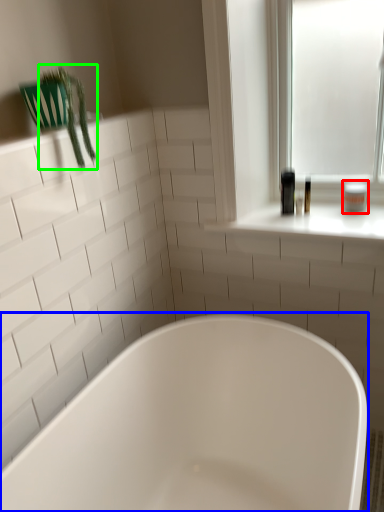
Question: Which object is the closest to the toiletry (highlighted by a red box)? Choose among these: bathtub (highlighted by a blue box) or plant (highlighted by a green box).

Choices:
 (A) bathtub
 (B) plant

Answer: (A)